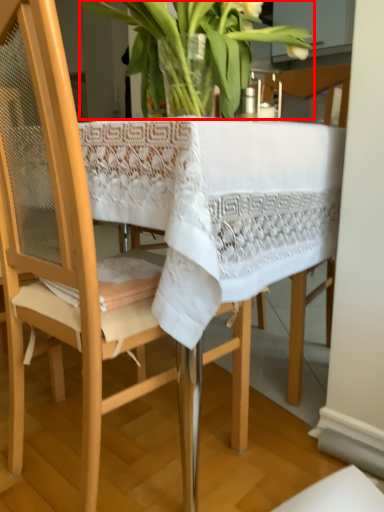
Question: From the image's perspective, what is the correct spatial positioning of houseplant (annotated by the red box) in reference to chair?

Choices:
 (A) below
 (B) above

Answer: (B)